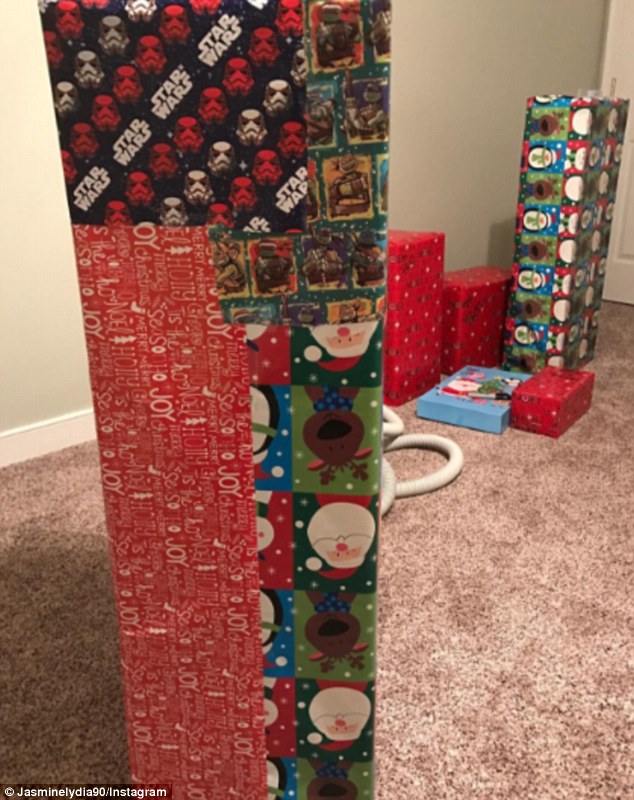
At what (x,y) coordinates should I click in order to perform the action: click on door panel. Please return your answer as a coordinate pair (x, y). The height and width of the screenshot is (800, 634). Looking at the image, I should click on (628, 240).